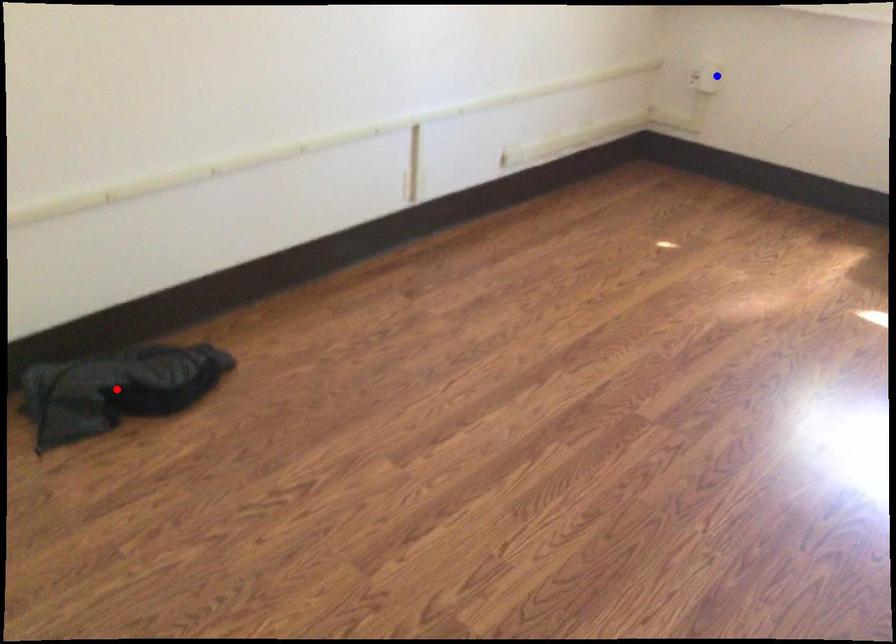
Question: Which of the two points in the image is closer to the camera?

Choices:
 (A) Blue point is closer.
 (B) Red point is closer.

Answer: (B)